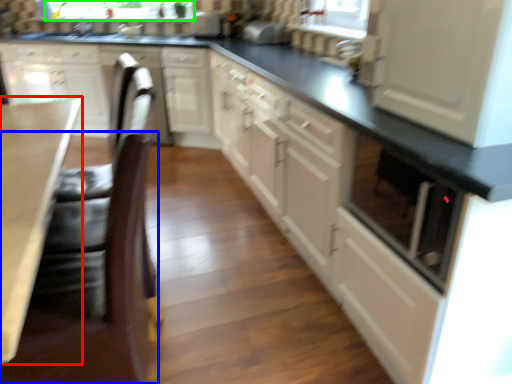
Question: Considering the real-world distances, which object is farthest from countertop (highlighted by a red box)? swivel chair (highlighted by a blue box) or bay window (highlighted by a green box)?

Choices:
 (A) swivel chair
 (B) bay window

Answer: (B)